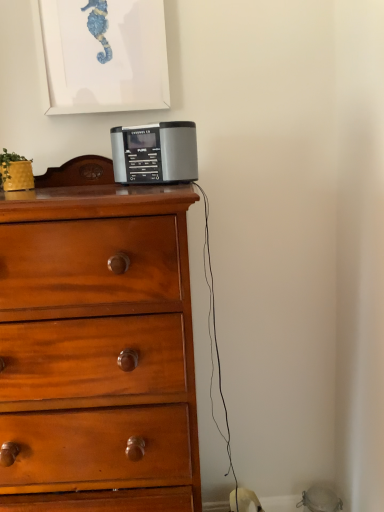
The image size is (384, 512). I want to click on silver/black plastic radio at center, so click(155, 153).

What do you see at coordinates (155, 153) in the screenshot?
I see `silver/black plastic radio at center` at bounding box center [155, 153].

This screenshot has height=512, width=384. Describe the element at coordinates (97, 343) in the screenshot. I see `wooden chest of drawers at center` at that location.

Find the location of `wooden chest of drawers at center`. wooden chest of drawers at center is located at coordinates (97, 343).

The image size is (384, 512). I want to click on silver/black plastic radio at center, so click(x=155, y=153).

Which is more to the right, wooden chest of drawers at center or silver/black plastic radio at center?

silver/black plastic radio at center is more to the right.

From the picture: Is wooden chest of drawers at center positioned behind silver/black plastic radio at center?

No, it is in front of silver/black plastic radio at center.

Is point (138, 479) less distant than point (124, 152)?

Yes, it is.

From the image's perspective, which one is positioned lower, wooden chest of drawers at center or silver/black plastic radio at center?

wooden chest of drawers at center appears lower in the image.

From a real-world perspective, is wooden chest of drawers at center under silver/black plastic radio at center?

Indeed, from a real-world perspective, wooden chest of drawers at center is positioned beneath silver/black plastic radio at center.

Can you confirm if wooden chest of drawers at center is thinner than silver/black plastic radio at center?

Incorrect, the width of wooden chest of drawers at center is not less than that of silver/black plastic radio at center.

Considering the relative sizes of wooden chest of drawers at center and silver/black plastic radio at center in the image provided, is wooden chest of drawers at center taller than silver/black plastic radio at center?

Indeed, wooden chest of drawers at center has a greater height compared to silver/black plastic radio at center.

Which of these two, wooden chest of drawers at center or silver/black plastic radio at center, is smaller?

With smaller size is silver/black plastic radio at center.

Is silver/black plastic radio at center located within wooden chest of drawers at center?

Yes, silver/black plastic radio at center is a part of wooden chest of drawers at center.

Based on the photo, are wooden chest of drawers at center and silver/black plastic radio at center located far from each other?

No, wooden chest of drawers at center is in close proximity to silver/black plastic radio at center.

Could you tell me if wooden chest of drawers at center is turned towards silver/black plastic radio at center?

No, wooden chest of drawers at center is not oriented towards silver/black plastic radio at center.

What's the angular difference between wooden chest of drawers at center and silver/black plastic radio at center's facing directions?

There is a 27.8-degree angle between the facing directions of wooden chest of drawers at center and silver/black plastic radio at center.

There is a wooden chest of drawers at center. At what (x,y) coordinates should I click in order to perform the action: click on home appliance above it (from a real-world perspective). Please return your answer as a coordinate pair (x, y). The image size is (384, 512). Looking at the image, I should click on (155, 153).

Is silver/black plastic radio at center to the left of wooden chest of drawers at center from the viewer's perspective?

Incorrect, silver/black plastic radio at center is not on the left side of wooden chest of drawers at center.

Is silver/black plastic radio at center in front of or behind wooden chest of drawers at center in the image?

In the image, silver/black plastic radio at center appears behind wooden chest of drawers at center.

Which is less distant, (193, 140) or (61, 412)?

Point (193, 140) is positioned farther from the camera compared to point (61, 412).

From the image's perspective, is silver/black plastic radio at center above wooden chest of drawers at center?

Indeed, from the image's perspective, silver/black plastic radio at center is shown above wooden chest of drawers at center.

From a real-world perspective, is silver/black plastic radio at center over wooden chest of drawers at center?

Correct, in the physical world, silver/black plastic radio at center is higher than wooden chest of drawers at center.

Which object is wider, silver/black plastic radio at center or wooden chest of drawers at center?

With larger width is wooden chest of drawers at center.

Considering the relative sizes of silver/black plastic radio at center and wooden chest of drawers at center in the image provided, is silver/black plastic radio at center taller than wooden chest of drawers at center?

No, silver/black plastic radio at center is not taller than wooden chest of drawers at center.

Based on the photo, which of these two, silver/black plastic radio at center or wooden chest of drawers at center, is bigger?

wooden chest of drawers at center is bigger.

Based on the photo, do you think silver/black plastic radio at center is within wooden chest of drawers at center, or outside of it?

silver/black plastic radio at center is enclosed within wooden chest of drawers at center.

Is silver/black plastic radio at center positioned far away from wooden chest of drawers at center?

No.

Is silver/black plastic radio at center oriented away from wooden chest of drawers at center?

Yes, silver/black plastic radio at center is positioned with its back facing wooden chest of drawers at center.

At what (x,y) coordinates should I click in order to perform the action: click on home appliance above the wooden chest of drawers at center (from the image's perspective). Please return your answer as a coordinate pair (x, y). Looking at the image, I should click on (155, 153).

At what (x,y) coordinates should I click in order to perform the action: click on the chest of drawers that appears below the silver/black plastic radio at center (from a real-world perspective). Please return your answer as a coordinate pair (x, y). Looking at the image, I should click on (97, 343).

Image resolution: width=384 pixels, height=512 pixels. Identify the location of chest of drawers on the left of silver/black plastic radio at center. (97, 343).